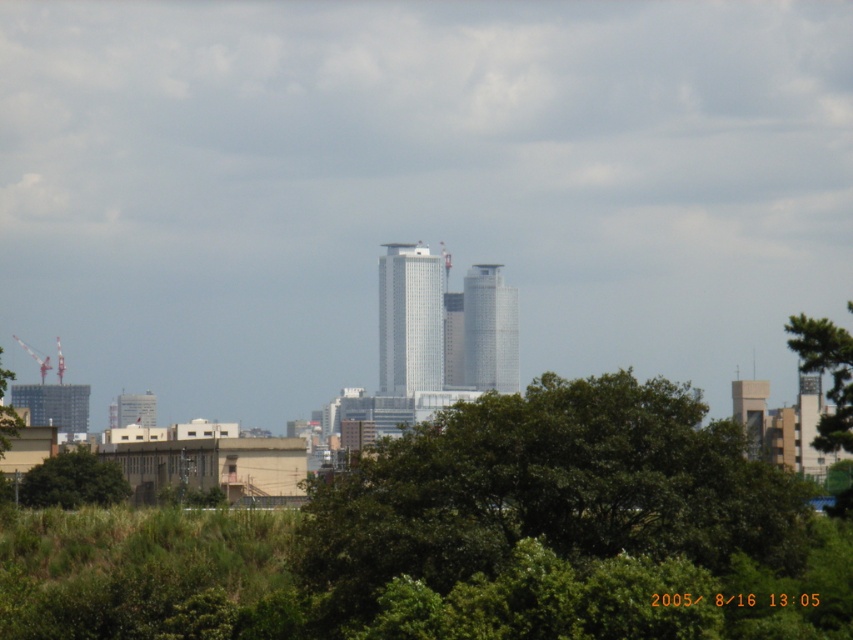
You are a drone operator trying to capture a photo of the city skyline. Your drone is currently hovering at the position of the green leafy tree at center. To avoid obstacles, you need to move it to a new location. Which direction should you move the drone to get a clear view of the tallest building in the scene?

Since the green leafy tree at center is located at point (548, 490), moving the drone away from this position towards the upper right direction would provide a clearer view of the tallest building in the scene.

You are a city planner evaluating a new park design. The park must include both a green leafy tree at center and a white glass building at center. Given their sizes, which one should be placed closer to the entrance to ensure visibility of both elements?

The green leafy tree at center is larger in size than the white glass building at center, so placing the smaller white glass building at center closer to the entrance would allow both elements to be visible without the larger tree obstructing the view.

You are standing at the base of the green leafy tree at center and want to take a photo of the tallest building in the cityscape. The camera you are using has a maximum zoom range that can capture objects up to 400 feet away. Can you capture the tallest building without moving closer?

The green leafy tree at center and camera are 375.33 feet apart from each other. Since the maximum zoom range is 400 feet, the camera can capture the tallest building without moving closer as 375.33 feet is within the 400 feet limit.